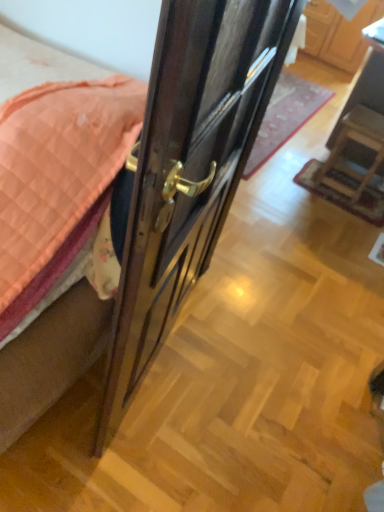
Question: From a real-world perspective, is wooden cabinet at upper center physically below glossy wood door at center?

Choices:
 (A) no
 (B) yes

Answer: (B)

Question: Does wooden cabinet at upper center contain glossy wood door at center?

Choices:
 (A) yes
 (B) no

Answer: (B)

Question: Is wooden cabinet at upper center wider than glossy wood door at center?

Choices:
 (A) no
 (B) yes

Answer: (B)

Question: Is wooden cabinet at upper center directly adjacent to glossy wood door at center?

Choices:
 (A) no
 (B) yes

Answer: (A)

Question: Is wooden cabinet at upper center looking in the opposite direction of glossy wood door at center?

Choices:
 (A) yes
 (B) no

Answer: (B)

Question: Considering the positions of polished brass door handle at center and brown fabric bed frame at left in the image, is polished brass door handle at center bigger or smaller than brown fabric bed frame at left?

Choices:
 (A) big
 (B) small

Answer: (A)

Question: In terms of height, does polished brass door handle at center look taller or shorter compared to brown fabric bed frame at left?

Choices:
 (A) short
 (B) tall

Answer: (A)

Question: From the image's perspective, is polished brass door handle at center above or below brown fabric bed frame at left?

Choices:
 (A) above
 (B) below

Answer: (A)

Question: Is polished brass door handle at center inside the boundaries of brown fabric bed frame at left, or outside?

Choices:
 (A) outside
 (B) inside

Answer: (A)

Question: Considering the relative positions of brown fabric bed frame at left and wooden cabinet at upper center in the image provided, is brown fabric bed frame at left to the left or to the right of wooden cabinet at upper center?

Choices:
 (A) right
 (B) left

Answer: (B)

Question: Does point (8, 413) appear closer or farther from the camera than point (354, 33)?

Choices:
 (A) closer
 (B) farther

Answer: (A)

Question: In terms of size, does brown fabric bed frame at left appear bigger or smaller than wooden cabinet at upper center?

Choices:
 (A) small
 (B) big

Answer: (A)

Question: From the image's perspective, relative to wooden cabinet at upper center, is brown fabric bed frame at left above or below?

Choices:
 (A) below
 (B) above

Answer: (A)

Question: From a real-world perspective, is wooden cabinet at upper center above or below polished brass door handle at center?

Choices:
 (A) above
 (B) below

Answer: (A)

Question: Is wooden cabinet at upper center inside the boundaries of polished brass door handle at center, or outside?

Choices:
 (A) outside
 (B) inside

Answer: (A)